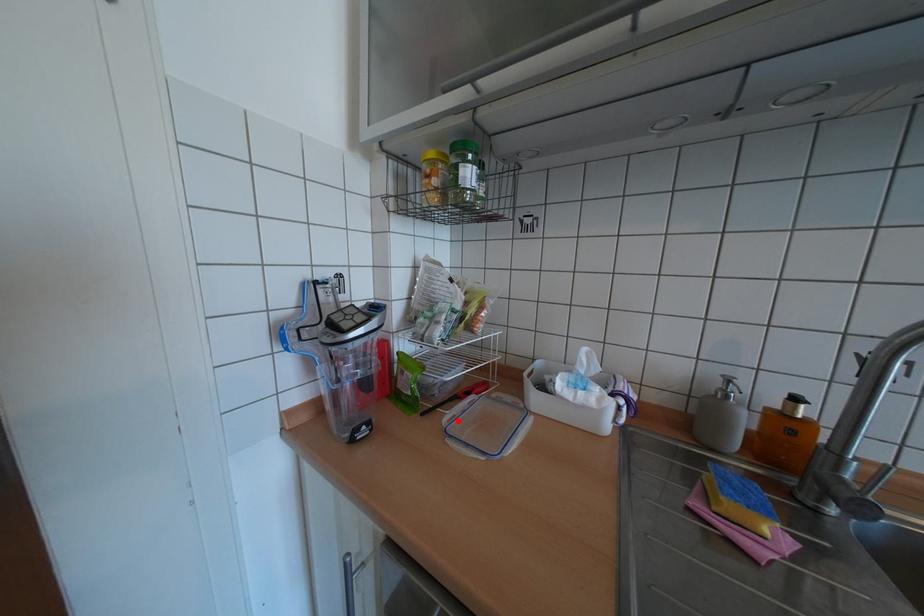
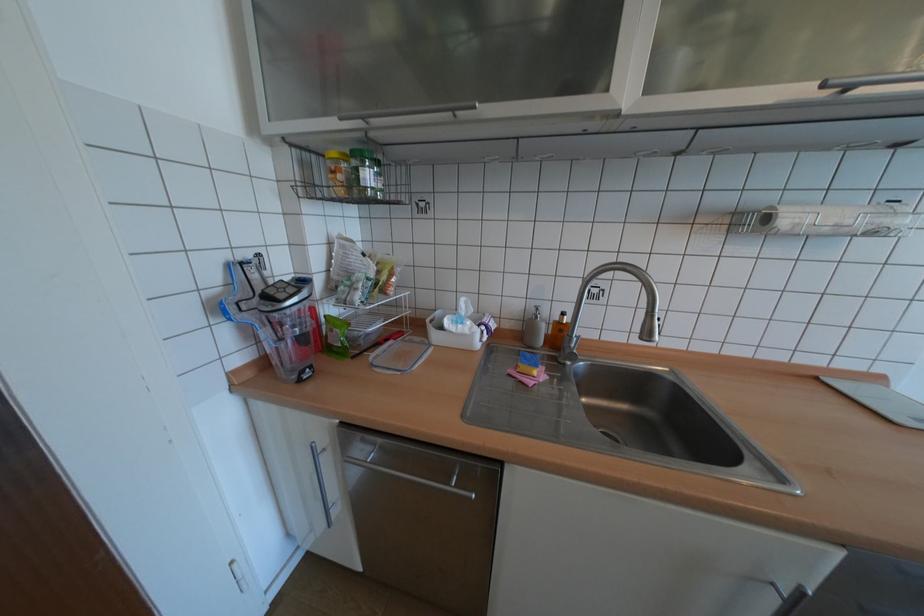
In the second image, find the point that corresponds to the highlighted location in the first image.

(383, 358)